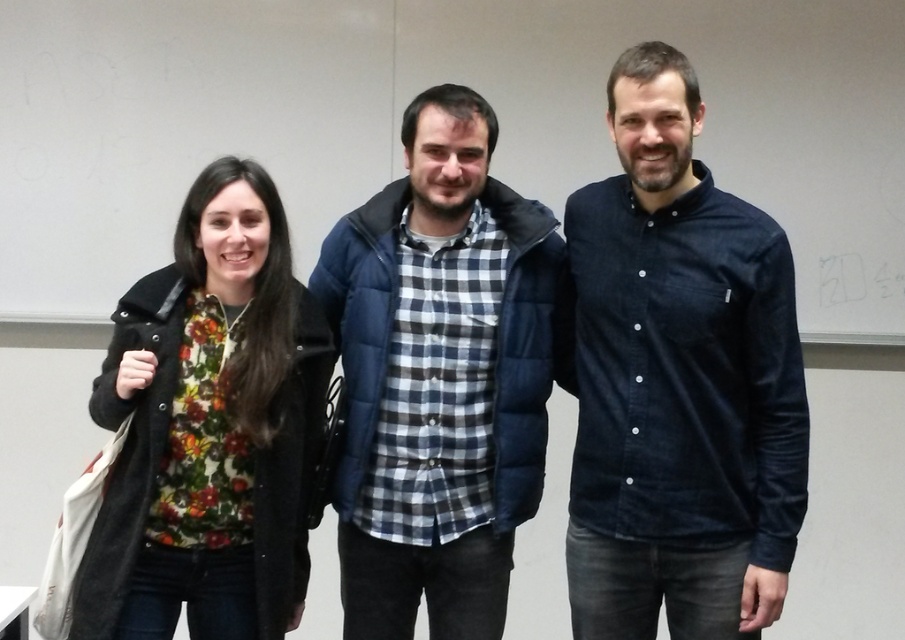
Between point (651, 625) and point (129, 378), which one is positioned in front?

Point (129, 378)

Is dark blue button-up shirt at center closer to camera compared to floral print shirt at left?

No, it is not.

Is point (618, 292) positioned behind point (141, 544)?

Yes, it is.

In order to click on dark blue button-up shirt at center in this screenshot , I will do tap(679, 381).

Can you confirm if dark blue button-up shirt at center is shorter than checkered fabric shirt at center?

No.

The image size is (905, 640). What do you see at coordinates (679, 381) in the screenshot?
I see `dark blue button-up shirt at center` at bounding box center [679, 381].

Locate an element on the screen. This screenshot has height=640, width=905. dark blue button-up shirt at center is located at coordinates (679, 381).

Does checkered fabric shirt at center come in front of floral print shirt at left?

No, checkered fabric shirt at center is further to the viewer.

How much distance is there between checkered fabric shirt at center and floral print shirt at left?

checkered fabric shirt at center is 11.54 inches away from floral print shirt at left.

Describe the element at coordinates (439, 378) in the screenshot. The width and height of the screenshot is (905, 640). I see `checkered fabric shirt at center` at that location.

Locate an element on the screen. The width and height of the screenshot is (905, 640). checkered fabric shirt at center is located at coordinates (439, 378).